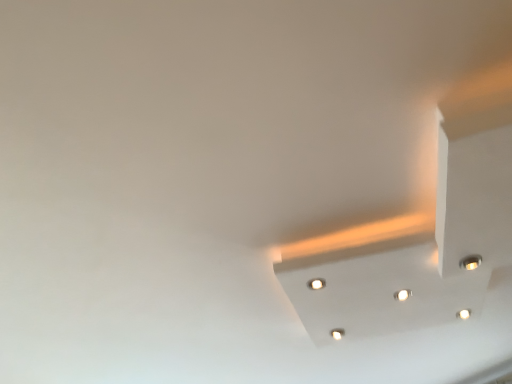
What do you see at coordinates (337, 333) in the screenshot? I see `matte white lamp at center` at bounding box center [337, 333].

Where is `matte white lamp at center`? matte white lamp at center is located at coordinates (337, 333).

Where is `matte white lamp at center`? matte white lamp at center is located at coordinates (337, 333).